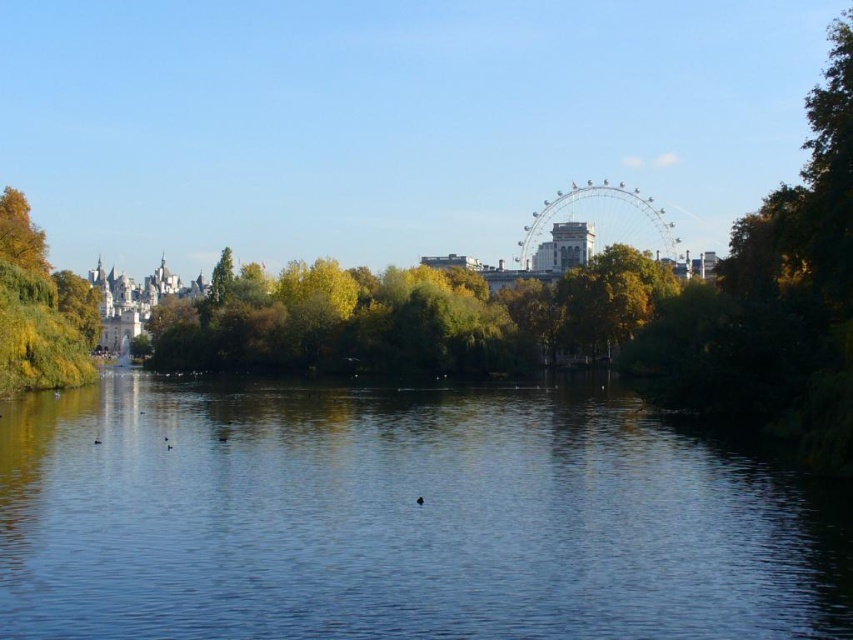
Between green leafy tree at left and brown fuzzy duck at center, which one is positioned higher?

Positioned higher is green leafy tree at left.

Is green leafy tree at left positioned in front of brown fuzzy duck at center?

No.

This screenshot has width=853, height=640. Find the location of `green leafy tree at left`. green leafy tree at left is located at coordinates (39, 308).

Find the location of a particular element. This screenshot has width=853, height=640. green leafy tree at left is located at coordinates (39, 308).

Can you confirm if transparent water at center is shorter than brown fuzzy duck at center?

No, transparent water at center is not shorter than brown fuzzy duck at center.

Between point (80, 465) and point (415, 502), which one is positioned in front?

Point (415, 502) is more forward.

Is point (107, 512) closer to camera compared to point (421, 502)?

Yes, it is in front of point (421, 502).

Identify the location of transparent water at center. (399, 518).

Which is more to the left, transparent water at center or green leafy tree at left?

Positioned to the left is green leafy tree at left.

Is point (788, 554) closer to viewer compared to point (3, 246)?

Yes.

I want to click on transparent water at center, so click(399, 518).